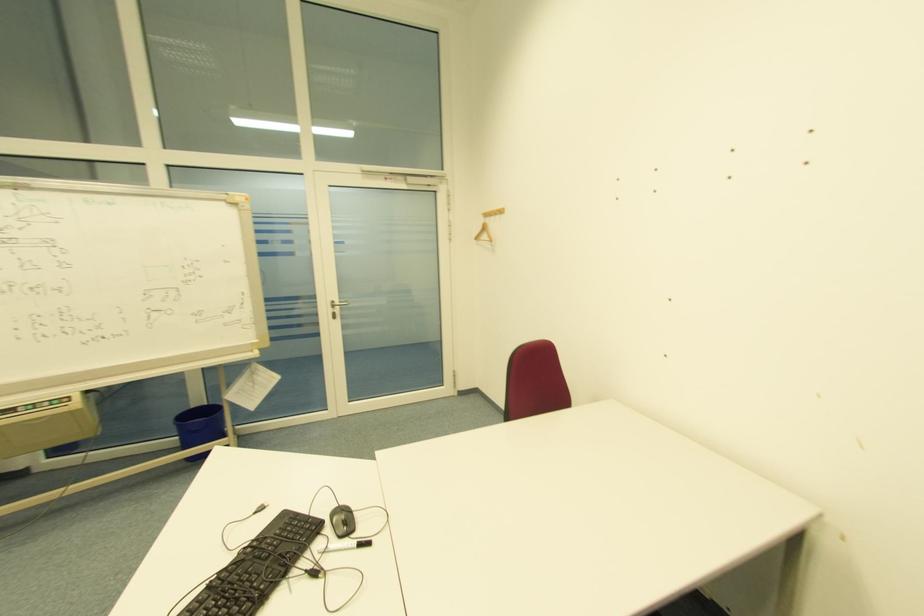
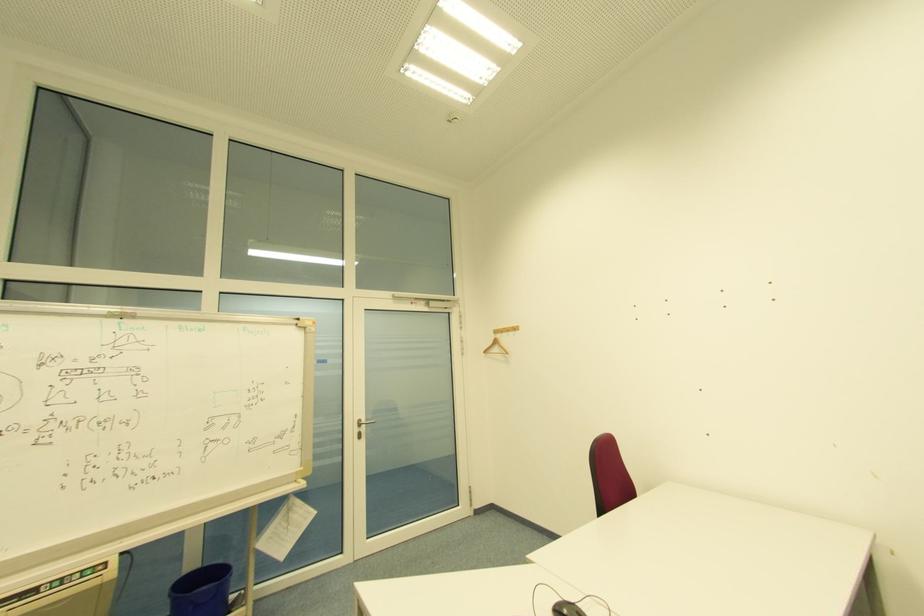
Question: How did the camera likely rotate?

Choices:
 (A) Left
 (B) Right
 (C) Up
 (D) Down

Answer: (C)